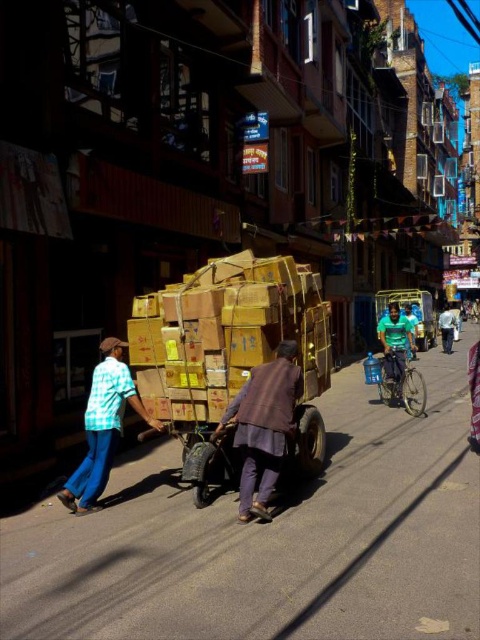
You are a delivery person trying to navigate through the street. There are two people wearing shirts, one with a checkered fabric shirt at left and another with a green fabric shirt at right. Which shirt is closer to you?

The checkered fabric shirt at left is closer to the viewer than the green fabric shirt at right.